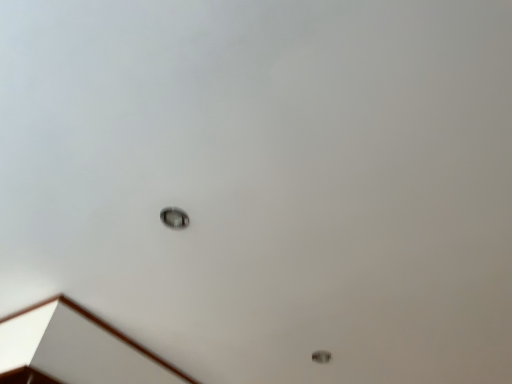
What is the approximate height of metallic ring at lower right?

0.42 inches.

This screenshot has width=512, height=384. What are the coordinates of `metallic ring at lower right` in the screenshot? It's located at (321, 356).

What do you see at coordinates (321, 356) in the screenshot? This screenshot has height=384, width=512. I see `metallic ring at lower right` at bounding box center [321, 356].

What is the approximate width of metallic ring at lower right?

8.36 centimeters.

Measure the distance between point (x=160, y=215) and camera.

Point (x=160, y=215) is 1.22 meters from camera.

Measure the distance between metallic circular light fixture at center and camera.

They are 1.19 meters apart.

At what (x,y) coordinates should I click in order to perform the action: click on metallic circular light fixture at center. Please return your answer as a coordinate pair (x, y). Looking at the image, I should click on (174, 218).

Image resolution: width=512 pixels, height=384 pixels. What do you see at coordinates (174, 218) in the screenshot? I see `metallic circular light fixture at center` at bounding box center [174, 218].

What is the approximate width of metallic circular light fixture at center?

3.53 inches.

You are a GUI agent. You are given a task and a screenshot of the screen. Output one action in this format:
    pyautogui.click(x=<x>, y=<y>)
    Task: Click on the metallic ring at lower right
    This screenshot has height=384, width=512.
    Given the screenshot: What is the action you would take?
    pyautogui.click(x=321, y=356)

Based on their positions, is metallic ring at lower right located to the left or right of metallic circular light fixture at center?

metallic ring at lower right is positioned on metallic circular light fixture at center's right side.

Which object is closer to the camera, metallic ring at lower right or metallic circular light fixture at center?

metallic circular light fixture at center is in front.

Considering the positions of point (328, 354) and point (185, 215), is point (328, 354) closer or farther from the camera than point (185, 215)?

Point (328, 354).

From the image's perspective, which is above, metallic ring at lower right or metallic circular light fixture at center?

From the image's view, metallic circular light fixture at center is above.

From a real-world perspective, which is physically below, metallic ring at lower right or metallic circular light fixture at center?

metallic ring at lower right, from a real-world perspective.

Considering the relative sizes of metallic ring at lower right and metallic circular light fixture at center in the image provided, is metallic ring at lower right thinner than metallic circular light fixture at center?

Yes, metallic ring at lower right is thinner than metallic circular light fixture at center.

Is metallic ring at lower right taller than metallic circular light fixture at center?

No, metallic ring at lower right is not taller than metallic circular light fixture at center.

Considering the sizes of objects metallic ring at lower right and metallic circular light fixture at center in the image provided, who is smaller, metallic ring at lower right or metallic circular light fixture at center?

Smaller between the two is metallic ring at lower right.

Is metallic ring at lower right spatially inside metallic circular light fixture at center, or outside of it?

metallic ring at lower right cannot be found inside metallic circular light fixture at center.

Is metallic ring at lower right beside metallic circular light fixture at center?

No, metallic ring at lower right is not with metallic circular light fixture at center.

Is metallic ring at lower right turned away from metallic circular light fixture at center?

metallic ring at lower right does not have its back to metallic circular light fixture at center.

How much distance is there between metallic ring at lower right and metallic circular light fixture at center?

The distance of metallic ring at lower right from metallic circular light fixture at center is 33.44 inches.

Locate an element on the screen. This screenshot has width=512, height=384. dot above the metallic ring at lower right (from the image's perspective) is located at coordinates (174, 218).

Considering the relative positions of metallic circular light fixture at center and metallic ring at lower right in the image provided, is metallic circular light fixture at center to the right of metallic ring at lower right from the viewer's perspective?

Incorrect, metallic circular light fixture at center is not on the right side of metallic ring at lower right.

Which object is closer to the camera taking this photo, metallic circular light fixture at center or metallic ring at lower right?

metallic circular light fixture at center is closer to the camera.

Is point (170, 221) closer to camera compared to point (318, 355)?

That is True.

From the image's perspective, is metallic circular light fixture at center located above or below metallic ring at lower right?

Clearly, from the image's perspective, metallic circular light fixture at center is above metallic ring at lower right.

From a real-world perspective, does metallic circular light fixture at center sit lower than metallic ring at lower right?

Incorrect, from a real-world perspective, metallic circular light fixture at center is higher than metallic ring at lower right.

Considering the relative sizes of metallic circular light fixture at center and metallic ring at lower right in the image provided, is metallic circular light fixture at center thinner than metallic ring at lower right?

No.

Is metallic circular light fixture at center taller than metallic ring at lower right?

Yes.

Is metallic circular light fixture at center smaller than metallic ring at lower right?

Actually, metallic circular light fixture at center might be larger than metallic ring at lower right.

Would you say metallic circular light fixture at center contains metallic ring at lower right?

Actually, metallic ring at lower right is outside metallic circular light fixture at center.

Is metallic circular light fixture at center next to metallic ring at lower right?

No, metallic circular light fixture at center is not with metallic ring at lower right.

Is metallic circular light fixture at center turned away from metallic ring at lower right?

No, metallic circular light fixture at center's orientation is not away from metallic ring at lower right.

Locate an element on the screen. lamp behind the metallic circular light fixture at center is located at coordinates (321, 356).

At what (x,y) coordinates should I click in order to perform the action: click on lamp below the metallic circular light fixture at center (from the image's perspective). Please return your answer as a coordinate pair (x, y). Looking at the image, I should click on (321, 356).

The image size is (512, 384). Find the location of `lamp on the right of metallic circular light fixture at center`. lamp on the right of metallic circular light fixture at center is located at coordinates (321, 356).